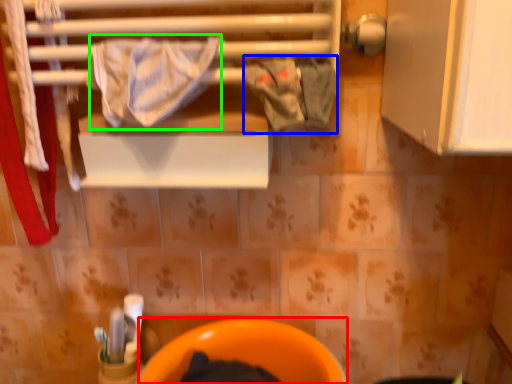
Question: Which is nearer to the toilet bowl (highlighted by a red box)? clothing (highlighted by a blue box) or bath towel (highlighted by a green box).

Choices:
 (A) clothing
 (B) bath towel

Answer: (A)